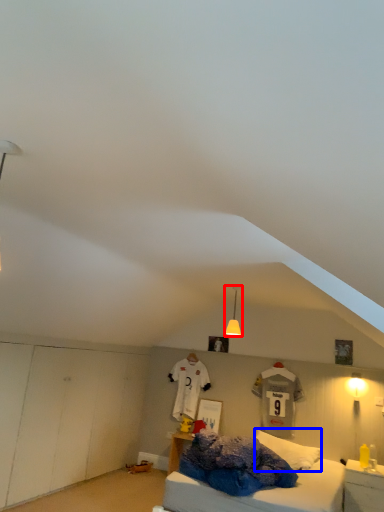
Question: Which point is closer to the camera, light fixture (highlighted by a red box) or pillow (highlighted by a blue box)?

Choices:
 (A) light fixture
 (B) pillow

Answer: (A)